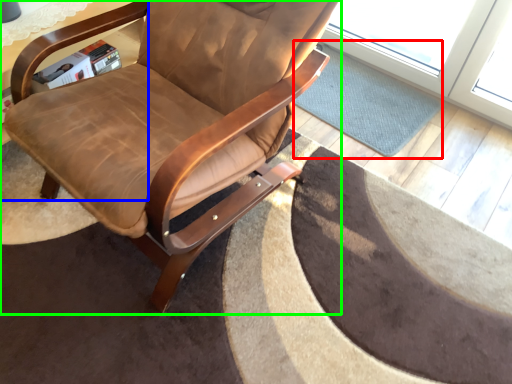
Question: Considering the real-world distances, which object is farthest from mat (highlighted by a red box)? table (highlighted by a blue box) or chair (highlighted by a green box)?

Choices:
 (A) table
 (B) chair

Answer: (A)